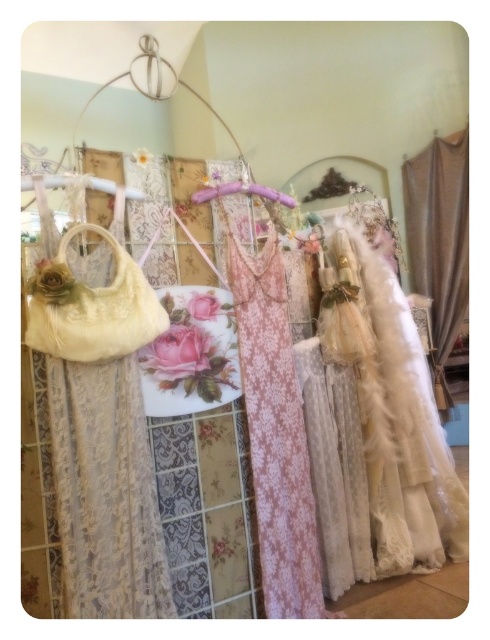
Between point (162, 545) and point (254, 188), which one is positioned behind?

Point (254, 188)

Who is more forward, (x=141, y=326) or (x=249, y=188)?

Point (x=141, y=326)

Between point (141, 488) and point (245, 182), which one is positioned in front?

Point (141, 488)

This screenshot has width=490, height=640. Identify the location of lace fabric at left. (100, 420).

Can you confirm if white lace dress at center is shorter than satin beige curtain at right?

Yes.

Based on the photo, can you confirm if white lace dress at center is positioned above satin beige curtain at right?

Actually, white lace dress at center is below satin beige curtain at right.

Find the location of a particular element. white lace dress at center is located at coordinates (392, 408).

Which is below, lace fabric at left or white lace dress at center?

Positioned lower is white lace dress at center.

Can you confirm if lace fabric at left is positioned above white lace dress at center?

Yes, lace fabric at left is above white lace dress at center.

Is point (133, 598) closer to viewer compared to point (416, 401)?

Yes.

I want to click on lace fabric at left, so click(100, 420).